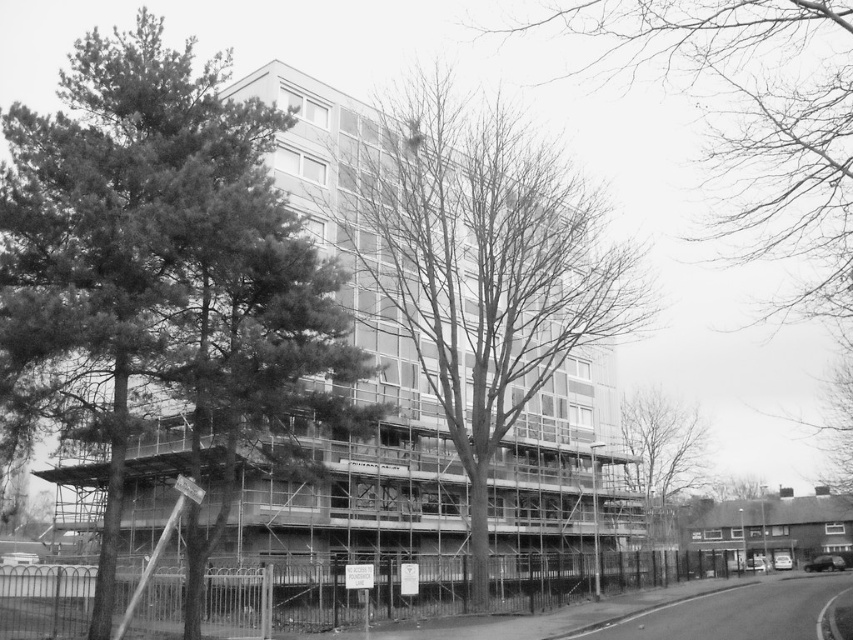
Does green leafy tree at left come in front of bare branches at lower right?

That is True.

Who is more distant from viewer, (276, 196) or (688, 492)?

The point (688, 492) is more distant.

Locate an element on the screen. The width and height of the screenshot is (853, 640). green leafy tree at left is located at coordinates (161, 262).

From the picture: Between bare branches at center and bare branches at upper center, which one appears on the left side from the viewer's perspective?

bare branches at center is more to the left.

Between point (480, 368) and point (799, 19), which one is positioned in front?

Positioned in front is point (799, 19).

Locate an element on the screen. bare branches at center is located at coordinates (479, 264).

Between green leafy tree at left and bare branches at center, which one appears on the right side from the viewer's perspective?

bare branches at center

Does green leafy tree at left have a larger size compared to bare branches at center?

Actually, green leafy tree at left might be smaller than bare branches at center.

Is point (157, 330) positioned in front of point (457, 230)?

Yes, point (157, 330) is in front of point (457, 230).

Where is `green leafy tree at left`? This screenshot has height=640, width=853. green leafy tree at left is located at coordinates (161, 262).